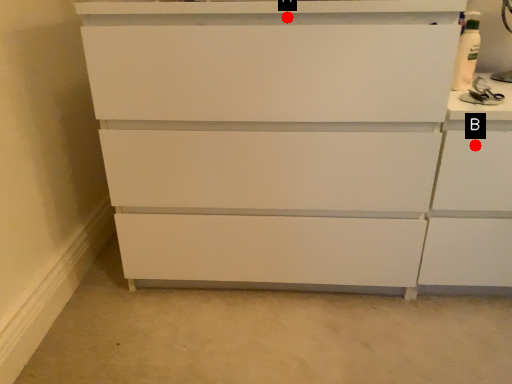
Question: Two points are circled on the image, labeled by A and B beside each circle. Which of the following is the closest to the observer?

Choices:
 (A) A is closer
 (B) B is closer

Answer: (A)